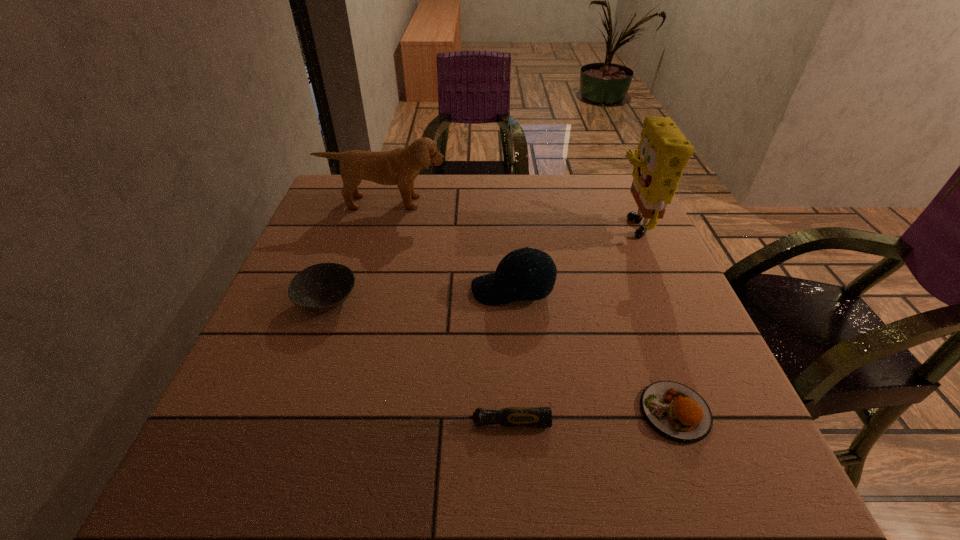
The width and height of the screenshot is (960, 540). Identify the location of vacant space in between the patty and the sponge. (653, 317).

Identify the location of the third closest object to the second shortest object. This screenshot has width=960, height=540. (663, 152).

Locate an element on the screen. object that stands as the fourth closest to the tallest object is located at coordinates (515, 417).

Where is `vacant space that satisfies the following two spatial constraints: 1. on the front-facing side of the second shortest object; 2. on the left side of the third tallest object`? vacant space that satisfies the following two spatial constraints: 1. on the front-facing side of the second shortest object; 2. on the left side of the third tallest object is located at coordinates (522, 411).

Locate an element on the screen. The image size is (960, 540). vacant point that satisfies the following two spatial constraints: 1. on the front-facing side of the fourth shortest object; 2. on the back side of the fifth tallest object is located at coordinates (522, 411).